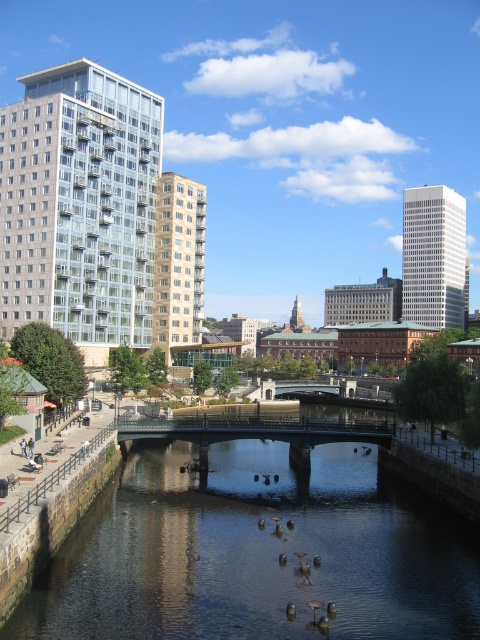
You are a city planner assessing the riverside area. You need to determine which area takes up more space in the image between the dark reflective water at center and the metallic gray bridge at center. Which one occupies a larger portion of the scene?

The metallic gray bridge at center occupies more space than the dark reflective water at center in the scene according to the description.

You are a city planner assessing the riverside area. You need to determine if the dark reflective water at center can accommodate a new floating platform that requires a minimum width of 10 meters. Given that the metallic gray bridge at center is known to be 15 meters wide, can the water area support the platform?

The dark reflective water at center has a width less than the metallic gray bridge at center, which is 15 meters wide. Since the water is narrower than the bridge, it is likely insufficient to accommodate the 10 meter platform. However, without exact measurements, this is an estimate based on relative sizes.